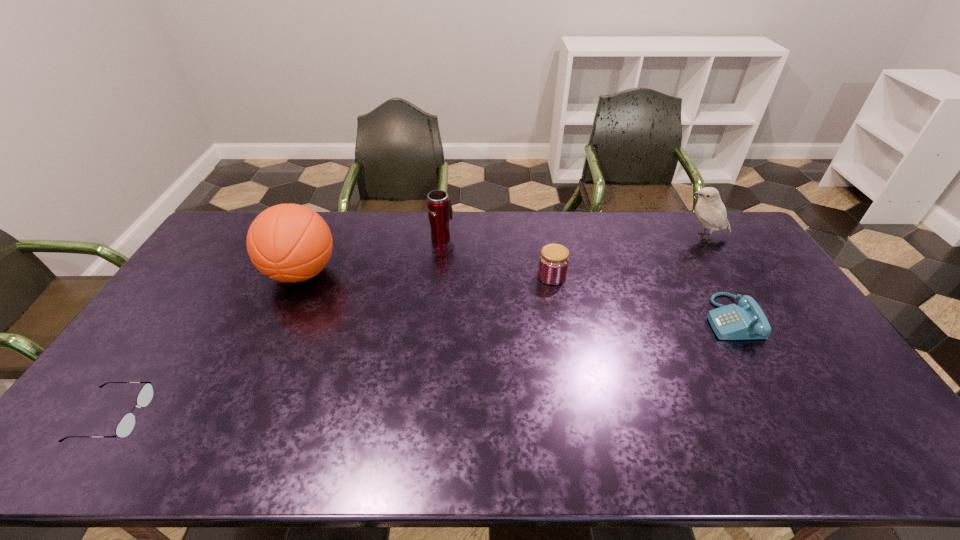
Identify the location of bird located at the far edge. This screenshot has height=540, width=960. (710, 210).

Where is `thermos bottle that is at the far edge`? The image size is (960, 540). thermos bottle that is at the far edge is located at coordinates (440, 212).

Image resolution: width=960 pixels, height=540 pixels. I want to click on object located at the near edge, so click(126, 425).

Identify the location of object that is at the left edge. Image resolution: width=960 pixels, height=540 pixels. (126, 425).

Where is `bird located at the right edge`? This screenshot has height=540, width=960. bird located at the right edge is located at coordinates (710, 210).

Locate an element on the screen. This screenshot has width=960, height=540. telephone that is at the right edge is located at coordinates tap(746, 321).

Identify the location of object that is at the near left corner. (126, 425).

Where is `object at the far right corner`? object at the far right corner is located at coordinates [710, 210].

Find the location of a particular element. The width and height of the screenshot is (960, 540). free space at the far edge of the desktop is located at coordinates (645, 217).

Where is `vacant area at the near edge of the desktop`? The image size is (960, 540). vacant area at the near edge of the desktop is located at coordinates (727, 450).